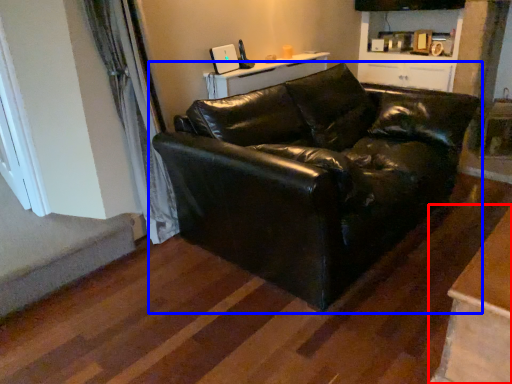
Question: Which point is closer to the camera, table (highlighted by a red box) or studio couch (highlighted by a blue box)?

Choices:
 (A) table
 (B) studio couch

Answer: (A)